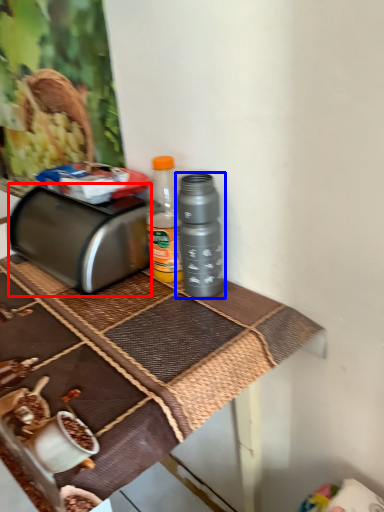
Question: Among these objects, which one is nearest to the camera, toaster (highlighted by a red box) or bottle (highlighted by a blue box)?

Choices:
 (A) toaster
 (B) bottle

Answer: (B)